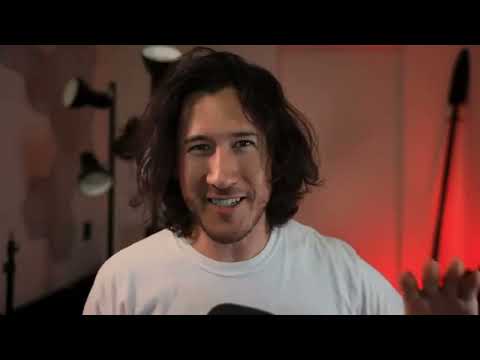
Identify the location of door frame. This screenshot has width=480, height=360. (398, 137).